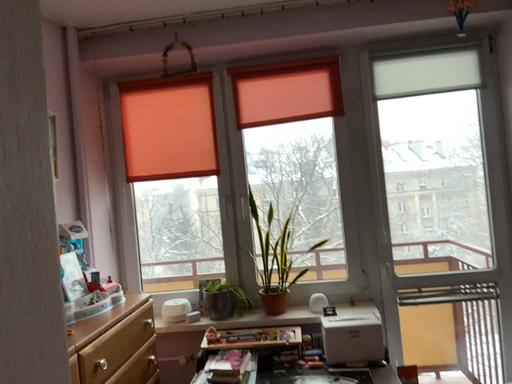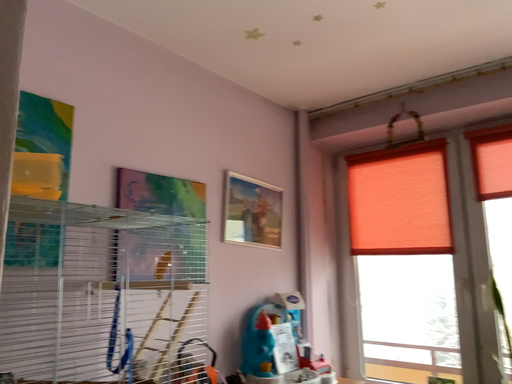
Question: How did the camera likely rotate when shooting the video?

Choices:
 (A) rotated upward
 (B) rotated downward

Answer: (A)